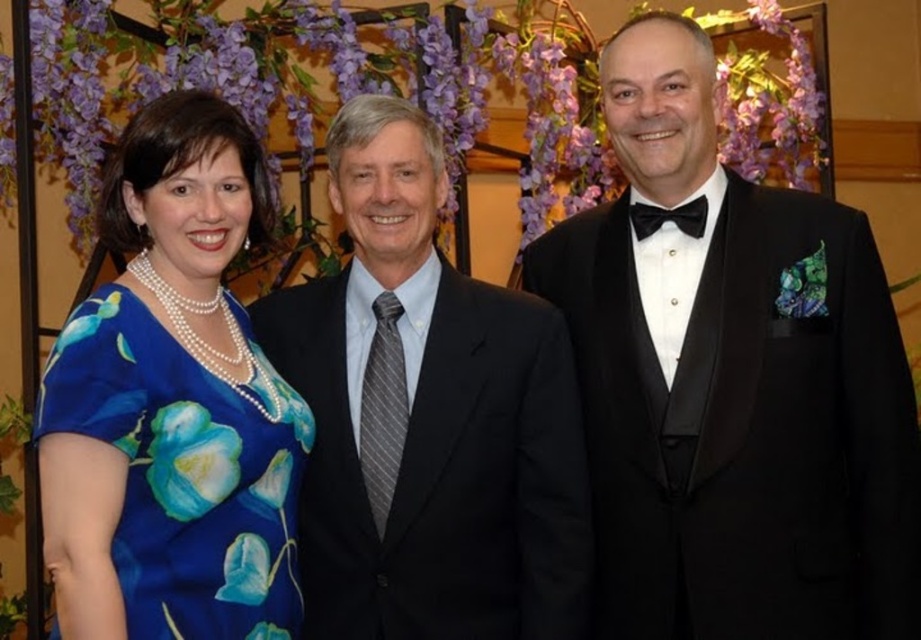
Question: Which of the following is the closest to the observer?

Choices:
 (A) (640, 493)
 (B) (634, 209)
 (C) (430, 124)
 (D) (115, 422)

Answer: (D)

Question: Is blue satin dress at left further to camera compared to black satin bow tie at center?

Choices:
 (A) yes
 (B) no

Answer: (B)

Question: Which point is farther to the camera?

Choices:
 (A) (630, 301)
 (B) (103, 369)

Answer: (A)

Question: Does black satin suit at center appear under blue satin dress at left?

Choices:
 (A) no
 (B) yes

Answer: (B)

Question: Which is nearer to the blue satin dress at left?

Choices:
 (A) black satin tuxedo at center
 (B) black satin suit at center
 (C) black satin bow tie at center

Answer: (B)

Question: Does black satin tuxedo at center appear on the left side of blue satin dress at left?

Choices:
 (A) yes
 (B) no

Answer: (B)